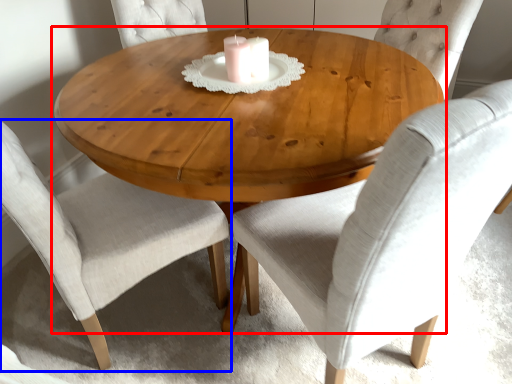
Question: Which object appears farthest to the camera in this image, coffee table (highlighted by a red box) or chair (highlighted by a blue box)?

Choices:
 (A) coffee table
 (B) chair

Answer: (A)